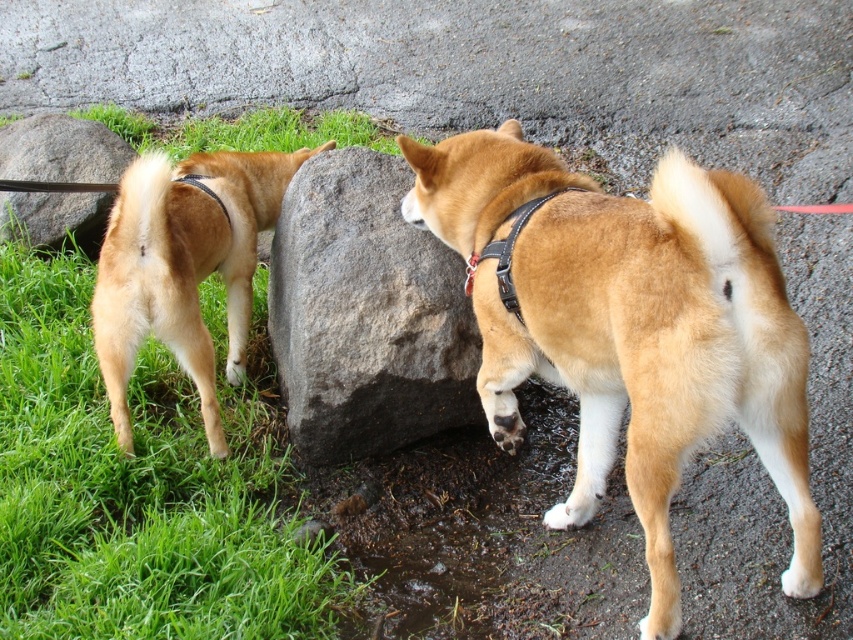
Is golden fur dog at center further to camera compared to green grass at lower left?

No, it is in front of green grass at lower left.

Can you confirm if golden fur dog at center is shorter than green grass at lower left?

Incorrect, golden fur dog at center's height does not fall short of green grass at lower left's.

Which is in front, point (647, 401) or point (7, 467)?

Point (647, 401) is more forward.

This screenshot has width=853, height=640. Identify the location of golden fur dog at center. [x=628, y=324].

Between golden fur dog at left and gray rock at center, which one has less height?

With less height is gray rock at center.

What do you see at coordinates (183, 266) in the screenshot? The height and width of the screenshot is (640, 853). I see `golden fur dog at left` at bounding box center [183, 266].

What are the coordinates of `golden fur dog at left` in the screenshot? It's located at (183, 266).

Find the location of a particular element. golden fur dog at left is located at coordinates (183, 266).

This screenshot has height=640, width=853. What do you see at coordinates (628, 324) in the screenshot?
I see `golden fur dog at center` at bounding box center [628, 324].

In the scene shown: Does golden fur dog at center have a greater height compared to golden fur dog at left?

Yes.

Identify the location of golden fur dog at center. The height and width of the screenshot is (640, 853). (628, 324).

Find the location of a particular element. Image resolution: width=853 pixels, height=640 pixels. golden fur dog at center is located at coordinates (628, 324).